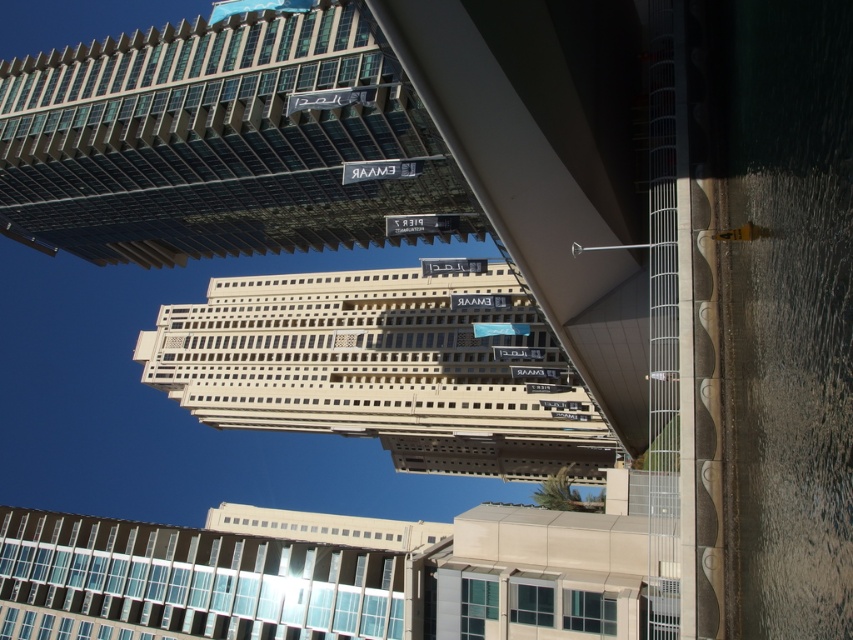
Between glassy steel skyscraper at upper left and white concrete building at center, which one has less height?

glassy steel skyscraper at upper left is shorter.

Does glassy steel skyscraper at upper left appear on the right side of white concrete building at center?

Incorrect, glassy steel skyscraper at upper left is not on the right side of white concrete building at center.

Is point (305, 36) positioned behind point (486, 289)?

That is False.

Where is `glassy steel skyscraper at upper left`? The height and width of the screenshot is (640, 853). glassy steel skyscraper at upper left is located at coordinates click(x=218, y=141).